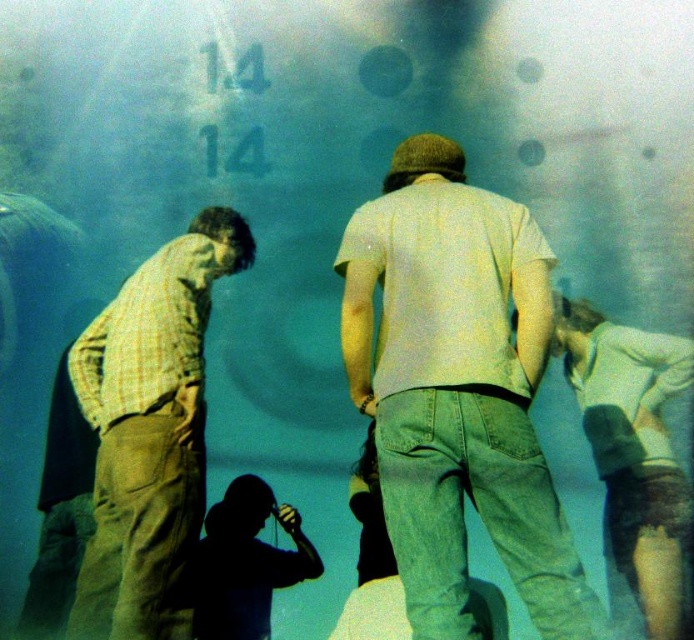
Which is more to the left, light gray cotton shirt at center or checkered fabric shirt at left?

checkered fabric shirt at left

Does light gray cotton shirt at center have a greater height compared to checkered fabric shirt at left?

Incorrect, light gray cotton shirt at center's height is not larger of checkered fabric shirt at left's.

The width and height of the screenshot is (694, 640). Describe the element at coordinates (457, 388) in the screenshot. I see `light gray cotton shirt at center` at that location.

Find the location of a particular element. Image resolution: width=694 pixels, height=640 pixels. light gray cotton shirt at center is located at coordinates (457, 388).

Does light gray cotton shirt at center appear on the right side of light blue denim shorts at lower right?

Incorrect, light gray cotton shirt at center is not on the right side of light blue denim shorts at lower right.

How far apart are light gray cotton shirt at center and light blue denim shorts at lower right?

light gray cotton shirt at center and light blue denim shorts at lower right are 3.97 feet apart.

Image resolution: width=694 pixels, height=640 pixels. I want to click on light gray cotton shirt at center, so click(457, 388).

Is checkered fabric shirt at left positioned at the back of light blue denim shorts at lower right?

That is False.

Who is more distant from viewer, (103,509) or (634,384)?

Positioned behind is point (634,384).

You are a GUI agent. You are given a task and a screenshot of the screen. Output one action in this format:
    pyautogui.click(x=<x>, y=<y>)
    Task: Click on the checkered fabric shirt at left
    Image resolution: width=694 pixels, height=640 pixels.
    Given the screenshot: What is the action you would take?
    point(149,432)